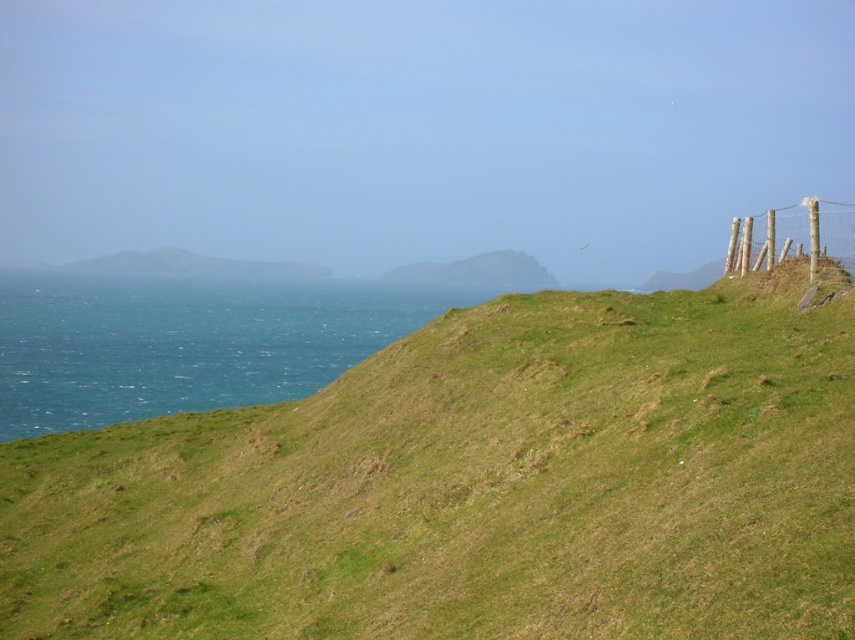
You are a hiker standing at the bottom of the green grassy hillside at upper right. You want to climb up to the wooden post fence at upper right. Can you see the top of the fence from your current position?

The green grassy hillside at upper right is shorter than the wooden post fence at upper right, so yes, you can see the top of the wooden post fence at upper right from your position at the bottom of the green grassy hillside at upper right.

You are standing at the top of the green grassy hillside at upper right and want to roll down to the blue water at left. Considering their widths, which area will you cover more as you roll down?

The blue water at left has a greater width than the green grassy hillside at upper right, so you will cover more area rolling down to the blue water at left.